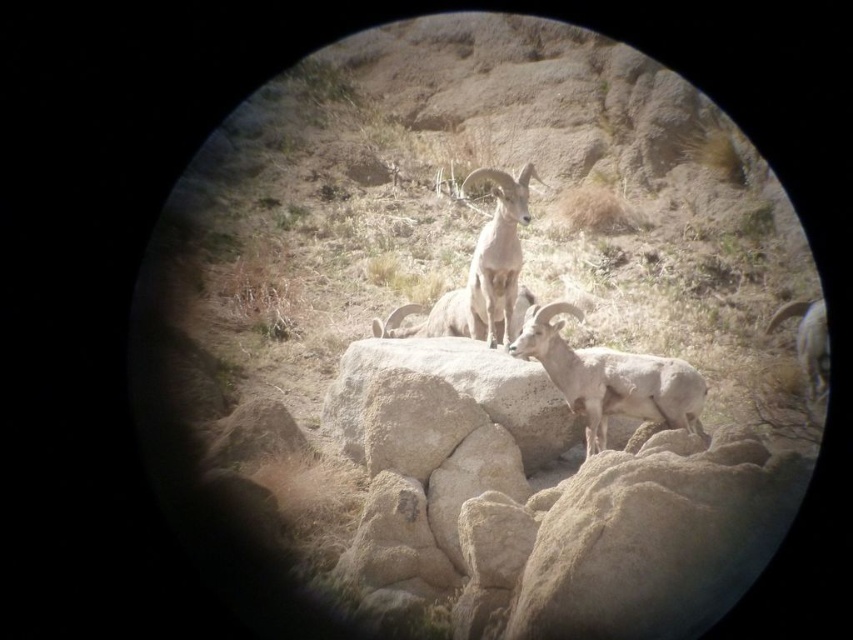
Does brown woolen goat at center have a smaller size compared to white woolen goat at right?

Yes, brown woolen goat at center is smaller than white woolen goat at right.

Can you confirm if brown woolen goat at center is positioned above white woolen goat at right?

Yes.

The height and width of the screenshot is (640, 853). What are the coordinates of `brown woolen goat at center` in the screenshot? It's located at (497, 253).

Which is more to the left, white woolly sheep at center or brown woolen goat at center?

brown woolen goat at center

Is point (598, 428) positioned after point (515, 298)?

That is False.

Does point (556, 368) come in front of point (469, 324)?

Yes, it is.

Locate an element on the screen. This screenshot has width=853, height=640. white woolly sheep at center is located at coordinates (610, 378).

Does point (560, 339) come farther from viewer compared to point (809, 400)?

That is False.

Can you confirm if white woolly sheep at center is wider than white woolen goat at right?

Indeed, white woolly sheep at center has a greater width compared to white woolen goat at right.

Find the location of a particular element. This screenshot has width=853, height=640. white woolly sheep at center is located at coordinates (610, 378).